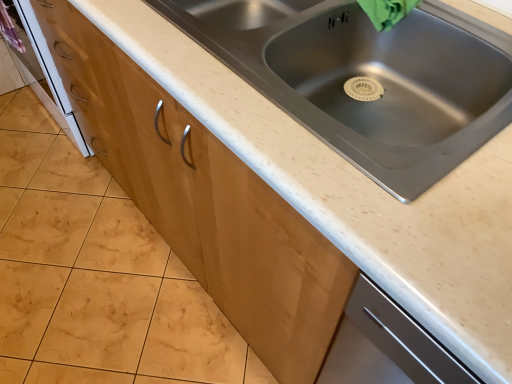
Question: Is stainless steel sink at center completely or partially outside of matte wood cabinet at center?

Choices:
 (A) yes
 (B) no

Answer: (A)

Question: Does stainless steel sink at center appear on the left side of matte wood cabinet at center?

Choices:
 (A) no
 (B) yes

Answer: (A)

Question: Can you confirm if stainless steel sink at center is positioned to the right of matte wood cabinet at center?

Choices:
 (A) no
 (B) yes

Answer: (B)

Question: Does stainless steel sink at center have a lesser width compared to matte wood cabinet at center?

Choices:
 (A) no
 (B) yes

Answer: (B)

Question: Can you confirm if stainless steel sink at center is wider than matte wood cabinet at center?

Choices:
 (A) no
 (B) yes

Answer: (A)

Question: Considering the positions of point (195, 144) and point (438, 135), is point (195, 144) closer or farther from the camera than point (438, 135)?

Choices:
 (A) closer
 (B) farther

Answer: (A)

Question: Considering the positions of matte wood cabinet at center and stainless steel sink at center in the image, is matte wood cabinet at center wider or thinner than stainless steel sink at center?

Choices:
 (A) wide
 (B) thin

Answer: (A)

Question: Considering the positions of matte wood cabinet at center and stainless steel sink at center in the image, is matte wood cabinet at center taller or shorter than stainless steel sink at center?

Choices:
 (A) tall
 (B) short

Answer: (B)

Question: From the image's perspective, is matte wood cabinet at center positioned above or below stainless steel sink at center?

Choices:
 (A) above
 (B) below

Answer: (B)

Question: Is point (41, 89) closer or farther from the camera than point (303, 340)?

Choices:
 (A) closer
 (B) farther

Answer: (B)

Question: Considering the positions of white glossy oven at lower left and matte wood cabinet at center in the image, is white glossy oven at lower left bigger or smaller than matte wood cabinet at center?

Choices:
 (A) big
 (B) small

Answer: (A)

Question: From their relative heights in the image, would you say white glossy oven at lower left is taller or shorter than matte wood cabinet at center?

Choices:
 (A) tall
 (B) short

Answer: (A)

Question: Relative to matte wood cabinet at center, is white glossy oven at lower left in front or behind?

Choices:
 (A) behind
 (B) front

Answer: (A)

Question: Is white glossy oven at lower left inside the boundaries of stainless steel sink at center, or outside?

Choices:
 (A) outside
 (B) inside

Answer: (A)

Question: Is point tap(77, 139) positioned closer to the camera than point tap(286, 72)?

Choices:
 (A) closer
 (B) farther

Answer: (B)